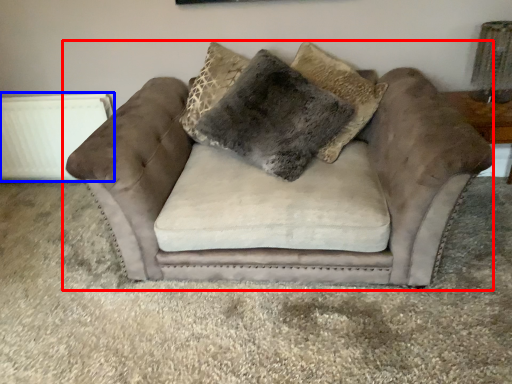
Question: Among these objects, which one is farthest to the camera, studio couch (highlighted by a red box) or radiator (highlighted by a blue box)?

Choices:
 (A) studio couch
 (B) radiator

Answer: (B)